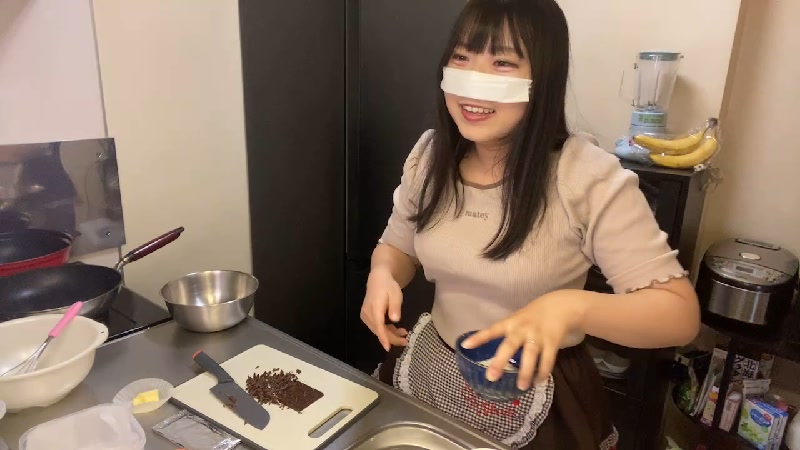
Where is `air fryer`? The height and width of the screenshot is (450, 800). air fryer is located at coordinates (746, 266).